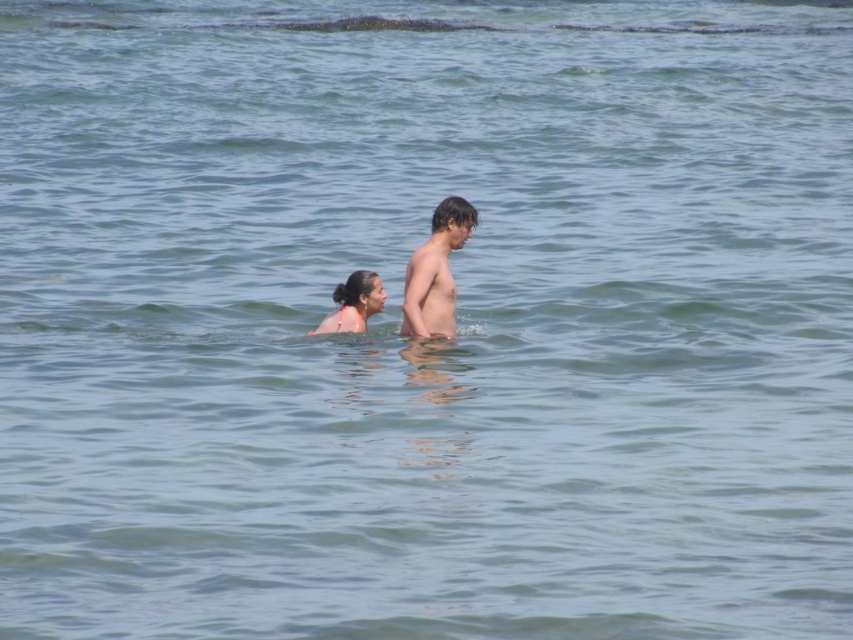
Can you confirm if pink matte skin at center is smaller than pink fabric bikini at center?

No.

Can you confirm if pink matte skin at center is thinner than pink fabric bikini at center?

Yes, pink matte skin at center is thinner than pink fabric bikini at center.

Locate an element on the screen. The width and height of the screenshot is (853, 640). pink matte skin at center is located at coordinates (436, 273).

Who is positioned more to the left, smooth skin boy at center or pink fabric bikini at center?

pink fabric bikini at center is more to the left.

Measure the distance between point (x=448, y=307) and camera.

They are 51.81 feet apart.

Between point (413, 259) and point (343, 301), which one is positioned behind?

The point (343, 301) is behind.

This screenshot has height=640, width=853. In order to click on smooth skin boy at center in this screenshot , I will do `click(436, 272)`.

Can you confirm if pink matte skin at center is positioned to the left of smooth skin boy at center?

Yes, pink matte skin at center is to the left of smooth skin boy at center.

Can you confirm if pink matte skin at center is positioned above smooth skin boy at center?

Yes, pink matte skin at center is above smooth skin boy at center.

Where is `pink matte skin at center`? Image resolution: width=853 pixels, height=640 pixels. pink matte skin at center is located at coordinates [x=436, y=273].